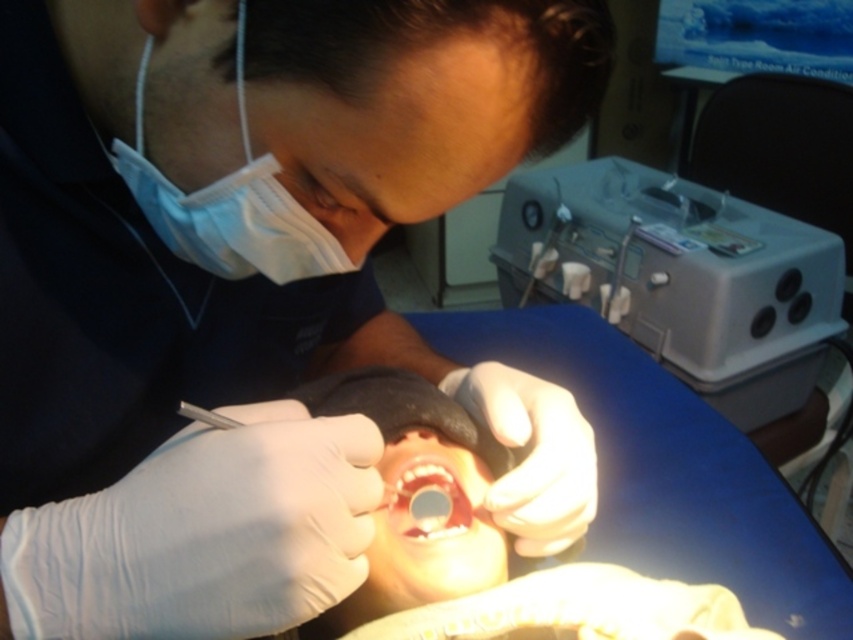
Between white latex gloves at center and smooth pinkish flesh at center, which one appears on the left side from the viewer's perspective?

Positioned to the left is white latex gloves at center.

Describe the element at coordinates (247, 291) in the screenshot. I see `white latex gloves at center` at that location.

At what (x,y) coordinates should I click in order to perform the action: click on white latex gloves at center. Please return your answer as a coordinate pair (x, y). Looking at the image, I should click on [x=247, y=291].

Consider the image. Is the position of gray plastic machine at upper right more distant than that of smooth pinkish flesh at center?

Yes, it is.

This screenshot has width=853, height=640. In order to click on gray plastic machine at upper right in this screenshot , I will do `click(682, 276)`.

Where is `gray plastic machine at upper right`? gray plastic machine at upper right is located at coordinates (682, 276).

The image size is (853, 640). What are the coordinates of `gray plastic machine at upper right` in the screenshot? It's located at (682, 276).

From the picture: Can you confirm if white latex gloves at center is thinner than blue disposable mask at upper left?

In fact, white latex gloves at center might be wider than blue disposable mask at upper left.

Between white latex gloves at center and blue disposable mask at upper left, which one appears on the right side from the viewer's perspective?

Positioned to the right is white latex gloves at center.

Is point (138, 612) closer to camera compared to point (299, 269)?

Yes, point (138, 612) is in front of point (299, 269).

You are a GUI agent. You are given a task and a screenshot of the screen. Output one action in this format:
    pyautogui.click(x=<x>, y=<y>)
    Task: Click on the white latex gloves at center
    The image size is (853, 640).
    Given the screenshot: What is the action you would take?
    pyautogui.click(x=247, y=291)